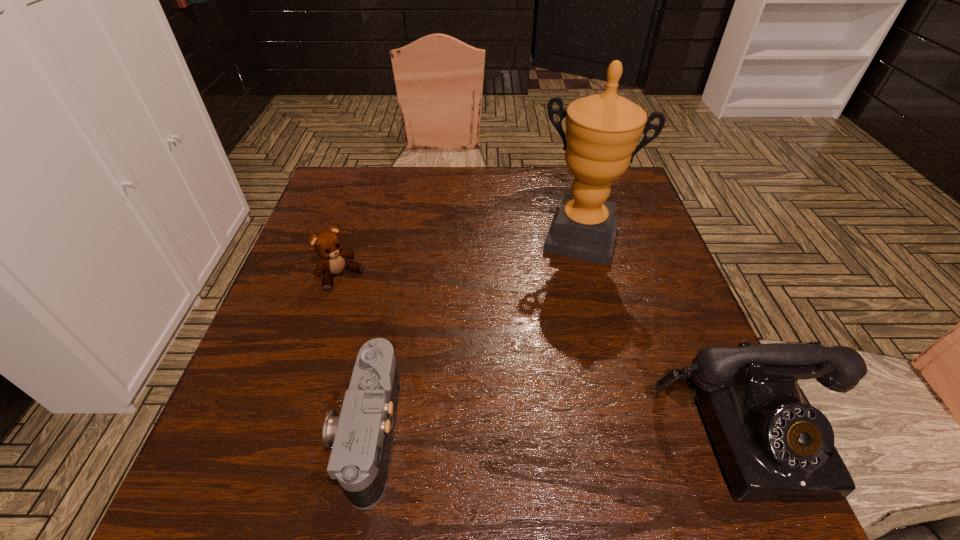
Locate an element on the screen. The height and width of the screenshot is (540, 960). vacant space at the right edge is located at coordinates (676, 388).

This screenshot has height=540, width=960. Find the location of `free space between the second object from left to right and the tallest object`. free space between the second object from left to right and the tallest object is located at coordinates (474, 335).

Where is `free spot between the teddy bear and the award`? Image resolution: width=960 pixels, height=540 pixels. free spot between the teddy bear and the award is located at coordinates 460,258.

Identify the location of vacant area that lies between the leftmost object and the tallest object. This screenshot has width=960, height=540. (460, 258).

Identify the location of free point between the tallest object and the teddy bear. (460, 258).

This screenshot has width=960, height=540. Identify the location of free space that is in between the tallest object and the telephone. (661, 335).

Locate an element on the screen. This screenshot has height=540, width=960. free spot between the third object from right to left and the telephone is located at coordinates (556, 432).

The height and width of the screenshot is (540, 960). In order to click on vacant space in between the camera and the teddy bear in this screenshot , I will do `click(354, 354)`.

Where is `free point between the award and the leftmost object`? This screenshot has height=540, width=960. free point between the award and the leftmost object is located at coordinates (460, 258).

This screenshot has width=960, height=540. Find the location of `unoccupied position between the telephone and the camera`. unoccupied position between the telephone and the camera is located at coordinates (556, 432).